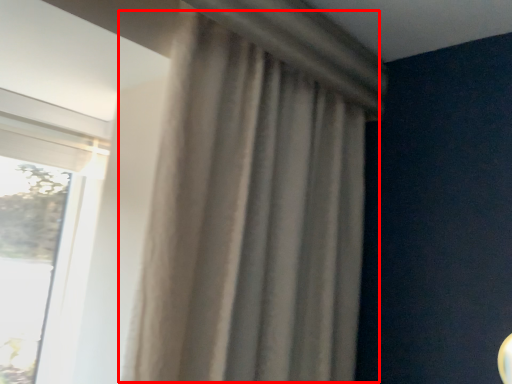
Question: From the image's perspective, considering the relative positions of curtain (annotated by the red box) and window in the image provided, where is curtain (annotated by the red box) located with respect to the staircase?

Choices:
 (A) below
 (B) above

Answer: (B)